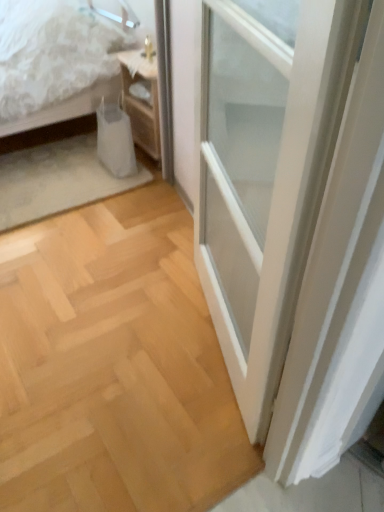
Question: Looking at their shapes, would you say white textured bed at upper left is wider or thinner than woodenmaterial/texturenightstand at upper left?

Choices:
 (A) wide
 (B) thin

Answer: (A)

Question: In the image, is white textured bed at upper left positioned in front of or behind woodenmaterial/texturenightstand at upper left?

Choices:
 (A) front
 (B) behind

Answer: (A)

Question: Considering the positions of white textured bed at upper left and woodenmaterial/texturenightstand at upper left in the image, is white textured bed at upper left taller or shorter than woodenmaterial/texturenightstand at upper left?

Choices:
 (A) short
 (B) tall

Answer: (B)

Question: Based on their sizes in the image, would you say woodenmaterial/texturenightstand at upper left is bigger or smaller than white textured bed at upper left?

Choices:
 (A) big
 (B) small

Answer: (B)

Question: From the image's perspective, is woodenmaterial/texturenightstand at upper left above or below white textured bed at upper left?

Choices:
 (A) above
 (B) below

Answer: (B)

Question: Does point (142, 79) appear closer or farther from the camera than point (56, 99)?

Choices:
 (A) farther
 (B) closer

Answer: (A)

Question: From a real-world perspective, relative to white textured bed at upper left, is woodenmaterial/texturenightstand at upper left vertically above or below?

Choices:
 (A) below
 (B) above

Answer: (A)